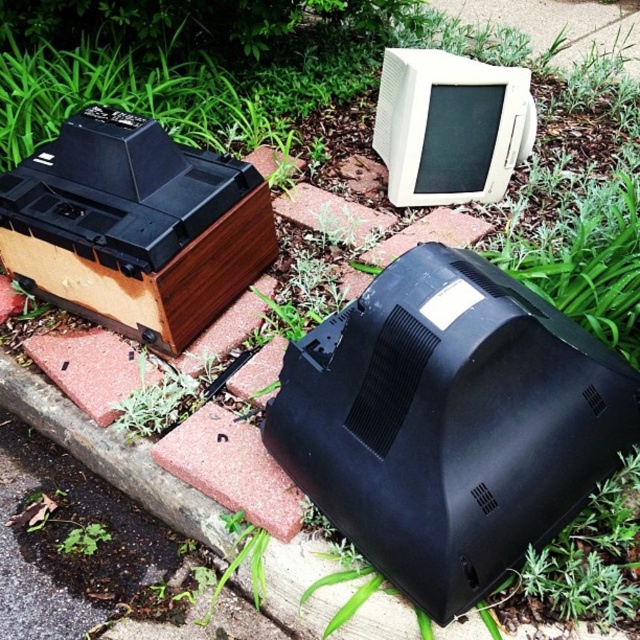
You are an electronics technician assessing the discarded devices. You need to determine which monitor is taller between the black matte monitor at center and the white plastic monitor at upper center. Based on their positions and sizes, which one is taller?

The black matte monitor at center is much taller than the white plastic monitor at upper center.

You are standing in a park and see the black matte monitor at center. If you take one large step forward, will you be able to touch it?

The black matte monitor at center is 3.36 feet away from viewer. A large step is typically about 2.5 to 3 feet, so after stepping forward, you would still be approximately 0.36 to 0.86 feet away, meaning you cannot touch it.

You are a technician trying to locate the black matte monitor at center in the image. According to the coordinates provided, where exactly is it positioned?

The black matte monitor at center is located at point coordinates 0.662 on the x axis and 0.703 on the y axis.